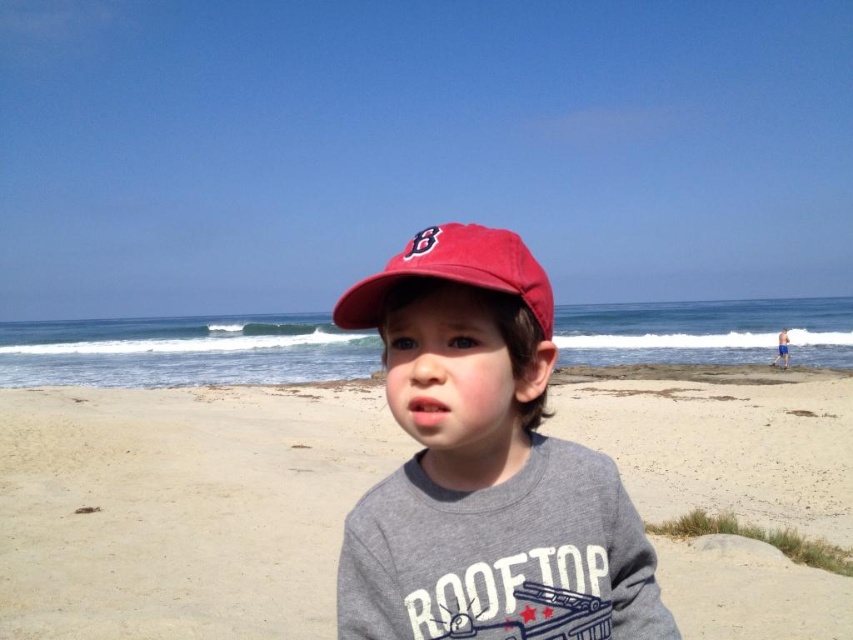
Is beige sand at center below matte red cap at center?

Yes, beige sand at center is below matte red cap at center.

Can you confirm if beige sand at center is positioned above matte red cap at center?

No, beige sand at center is not above matte red cap at center.

Is point (222, 532) more distant than point (566, 468)?

Yes, it is behind point (566, 468).

Identify the location of beige sand at center. (181, 508).

Which is below, beige sand at center or matte red baseball cap at center?

Positioned lower is beige sand at center.

Based on the photo, does beige sand at center lie in front of matte red baseball cap at center?

No, it is not.

Where is `beige sand at center`? This screenshot has height=640, width=853. beige sand at center is located at coordinates (181, 508).

You are a GUI agent. You are given a task and a screenshot of the screen. Output one action in this format:
    pyautogui.click(x=<x>, y=<y>)
    Task: Click on the beige sand at center
    This screenshot has width=853, height=640.
    Given the screenshot: What is the action you would take?
    pyautogui.click(x=181, y=508)

Does matte red cap at center have a smaller size compared to matte red baseball cap at center?

Correct, matte red cap at center occupies less space than matte red baseball cap at center.

Based on the photo, is matte red cap at center bigger than matte red baseball cap at center?

Incorrect, matte red cap at center is not larger than matte red baseball cap at center.

Describe the element at coordinates (485, 467) in the screenshot. I see `matte red cap at center` at that location.

Where is `matte red cap at center`? The width and height of the screenshot is (853, 640). matte red cap at center is located at coordinates (485, 467).